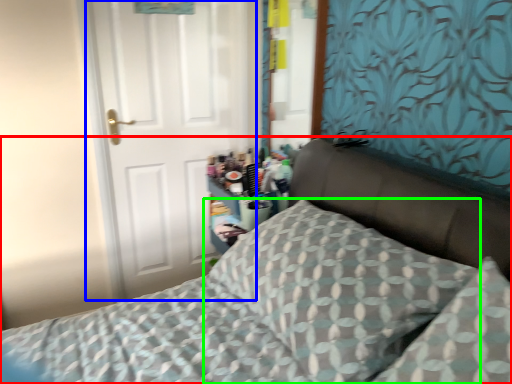
Question: Considering the real-world distances, which object is farthest from bed (highlighted by a red box)? door (highlighted by a blue box) or pillow (highlighted by a green box)?

Choices:
 (A) door
 (B) pillow

Answer: (A)